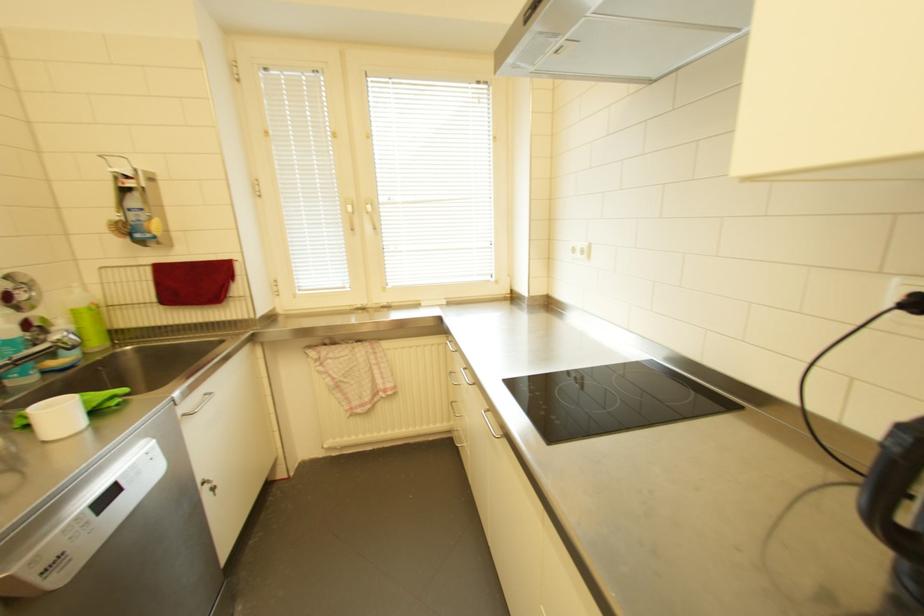
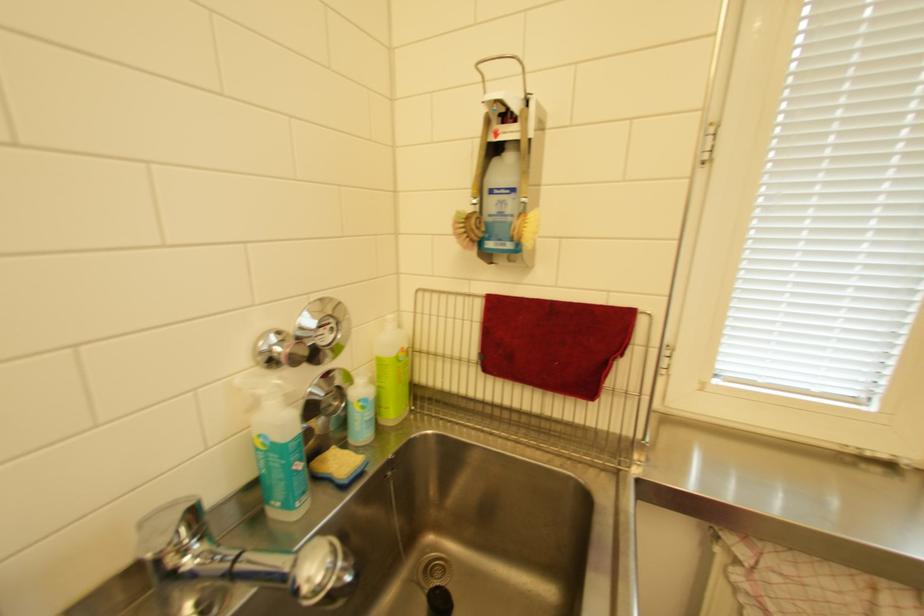
Find the pixel in the second image that matches (81,313) in the first image.

(386, 362)